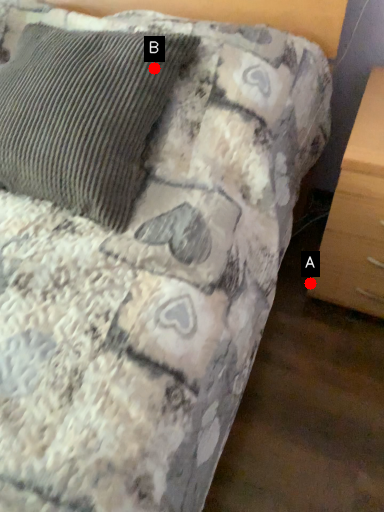
Question: Two points are circled on the image, labeled by A and B beside each circle. Which point appears farthest from the camera in this image?

Choices:
 (A) A is further
 (B) B is further

Answer: (A)